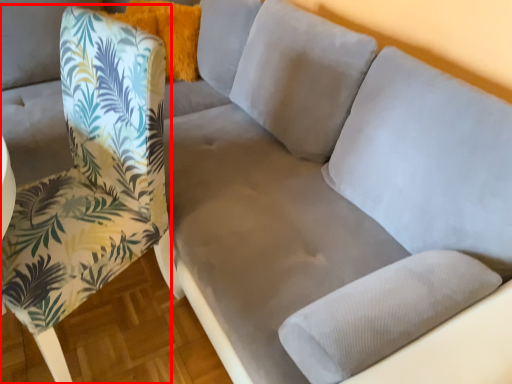
Question: From the image's perspective, where is chair (annotated by the red box) located relative to pillow?

Choices:
 (A) below
 (B) above

Answer: (A)